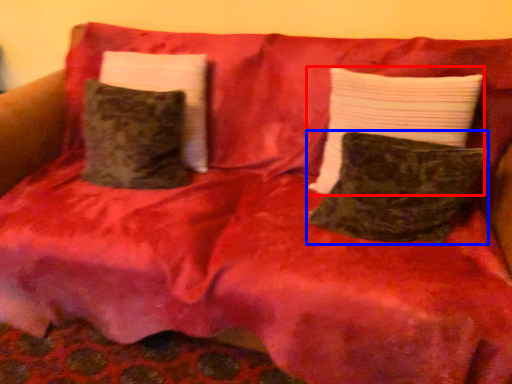
Question: Which object is closer to the camera taking this photo, pillow (highlighted by a red box) or pillow (highlighted by a blue box)?

Choices:
 (A) pillow
 (B) pillow

Answer: (B)